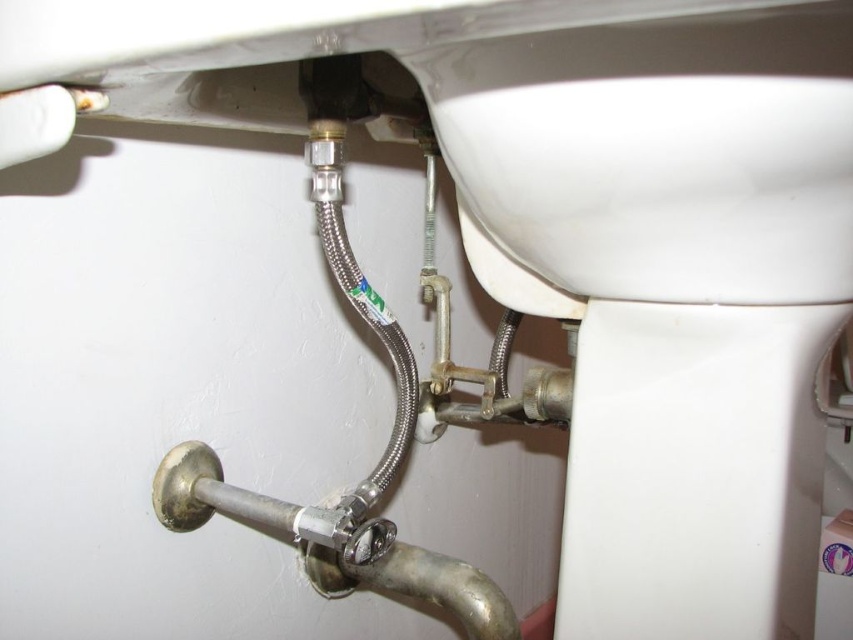
You are a plumber trying to access the silver metallic pipe at center to fix a leak. However, the white glossy sink at upper center is blocking your view. Can you move the sink to reach the pipe?

The white glossy sink at upper center is in front of the silver metallic pipe at center, so you cannot directly access the pipe without moving the sink. However, moving the sink may not be feasible as it is likely fixed in place. Consider alternative methods like working around the sink or adjusting your tools to reach behind it.

You are a plumber inspecting the bathroom plumbing. You notice the white glossy sink at upper center and the silver metallic pipe at center. Which object is positioned higher in the scene?

The white glossy sink at upper center is located above the silver metallic pipe at center, so it is positioned higher in the scene.

You are a plumber trying to inspect the flexible stainless steel hose connecting the toilet tank to the water supply. You have a 12 inch ruler. Can you measure the distance between the point labeled at coordinates point (811, 253) and the camera position using your ruler?

The distance between point (811, 253) and the camera is 14.61 inches. Since your ruler is only 12 inches long, it is not long enough to measure the full distance. You would need a longer measuring tool or extend the ruler somehow.